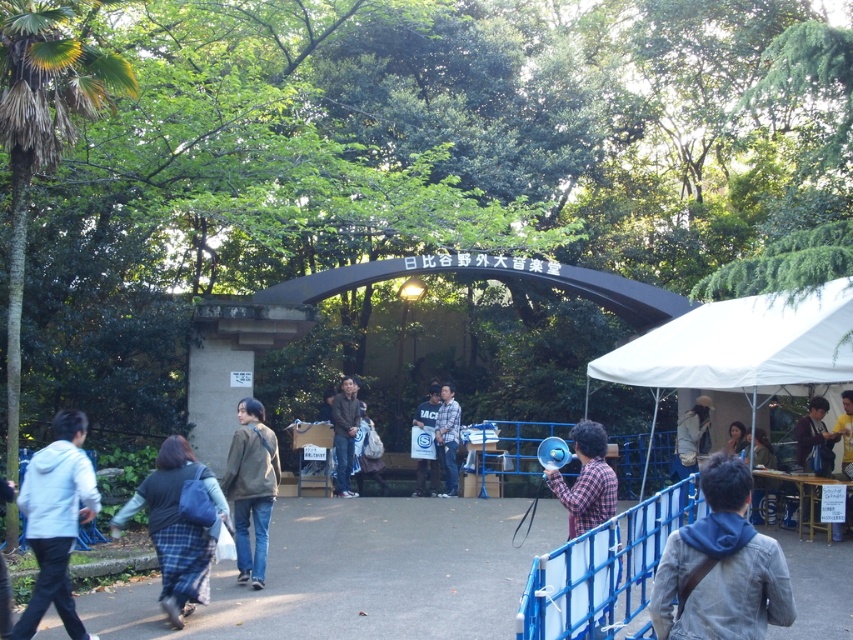
How distant is plaid shirt at center from light brown fabric backpack at center?

The distance of plaid shirt at center from light brown fabric backpack at center is 4.28 feet.

Is plaid shirt at center wider than light brown fabric backpack at center?

In fact, plaid shirt at center might be narrower than light brown fabric backpack at center.

Between point (456, 426) and point (376, 474), which one is positioned in front?

Point (456, 426) is in front.

The height and width of the screenshot is (640, 853). What are the coordinates of `plaid shirt at center` in the screenshot? It's located at (448, 436).

Between blue plaid skirt at lower left and dark brown leather jacket at center, which one is positioned higher?

Positioned higher is blue plaid skirt at lower left.

Between blue plaid skirt at lower left and dark brown leather jacket at center, which one has more height?

blue plaid skirt at lower left is taller.

Between point (169, 461) and point (747, 451), which one is positioned in front?

Point (169, 461)

The height and width of the screenshot is (640, 853). What are the coordinates of `blue plaid skirt at lower left` in the screenshot? It's located at (175, 524).

Can you confirm if gray hoodie at lower right is wider than light brown fabric backpack at center?

Indeed, gray hoodie at lower right has a greater width compared to light brown fabric backpack at center.

Between gray hoodie at lower right and light brown fabric backpack at center, which one appears on the right side from the viewer's perspective?

gray hoodie at lower right is more to the right.

Is point (711, 566) more distant than point (360, 449)?

No, it is not.

I want to click on gray hoodie at lower right, so click(x=722, y=566).